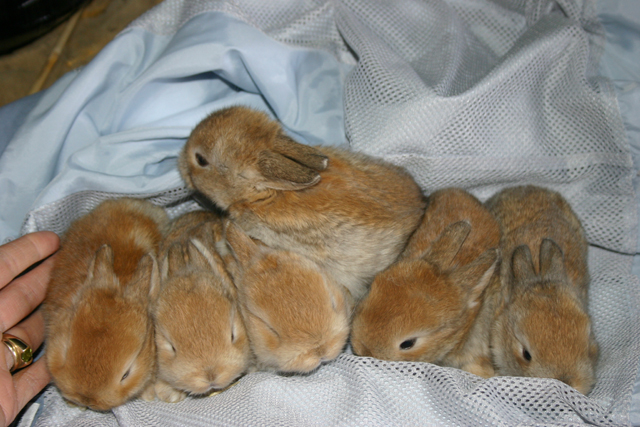
This screenshot has width=640, height=427. In order to click on blue fabric bed-sheet in this screenshot , I will do (301, 68).